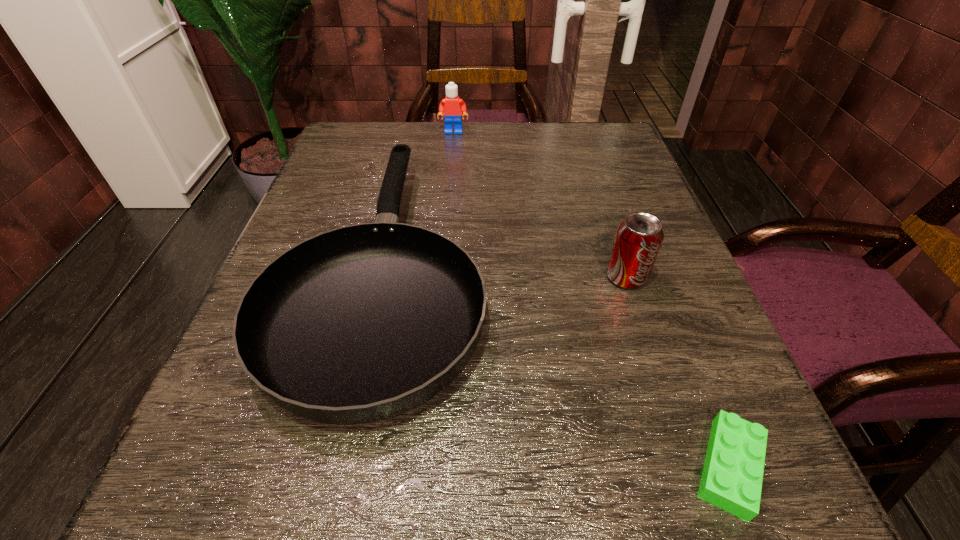
Locate an element on the screen. This screenshot has width=960, height=540. blank space at the far edge of the desktop is located at coordinates (453, 130).

Identify the location of blank space at the near edge of the desktop. (429, 489).

This screenshot has height=540, width=960. In the image, there is a desktop. What are the coordinates of `vacant space at the left edge` in the screenshot? It's located at (329, 189).

I want to click on free space at the right edge, so click(x=624, y=211).

Identify the location of free space at the far left corner of the desktop. The width and height of the screenshot is (960, 540). (330, 172).

What are the coordinates of `blank space at the far right corner` in the screenshot? It's located at pyautogui.click(x=584, y=123).

Where is `unoccupied position between the second shortest object and the soda can`? The height and width of the screenshot is (540, 960). unoccupied position between the second shortest object and the soda can is located at coordinates (506, 272).

Identify the location of unoccupied area between the soda can and the taller Lego. (540, 204).

The width and height of the screenshot is (960, 540). I want to click on vacant area between the taller Lego and the third tallest object, so click(x=420, y=200).

Where is `vacant space that's between the soda can and the shortest object`? vacant space that's between the soda can and the shortest object is located at coordinates (678, 372).